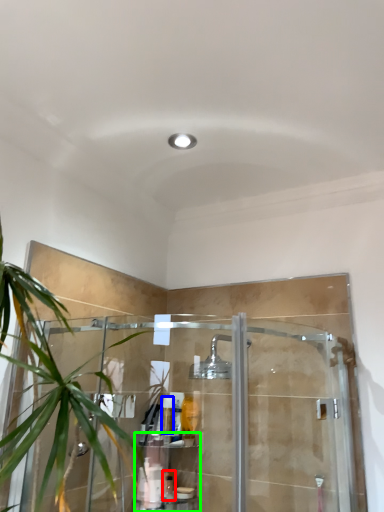
Question: Which object is the farthest from toiletry (highlighted by a red box)? Choose among these: toiletry (highlighted by a blue box) or shelf (highlighted by a green box).

Choices:
 (A) toiletry
 (B) shelf

Answer: (A)